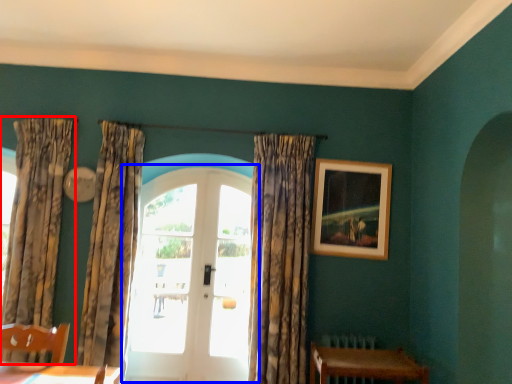
Question: Which of the following is the farthest to the observer, curtain (highlighted by a red box) or door (highlighted by a blue box)?

Choices:
 (A) curtain
 (B) door

Answer: (B)